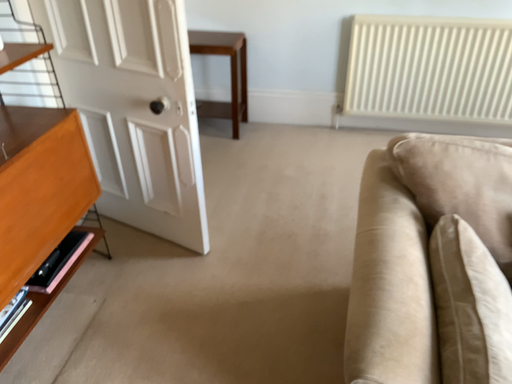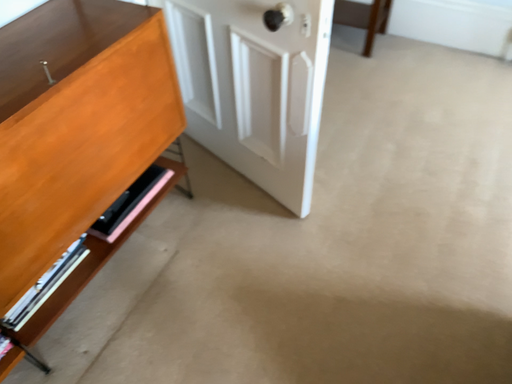
Question: How did the camera likely rotate when shooting the video?

Choices:
 (A) rotated upward
 (B) rotated downward

Answer: (B)